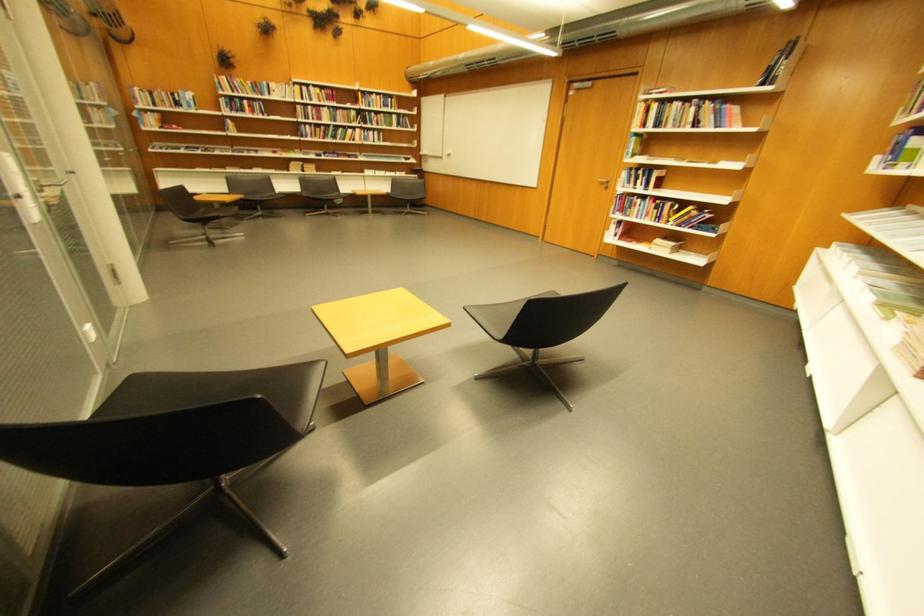
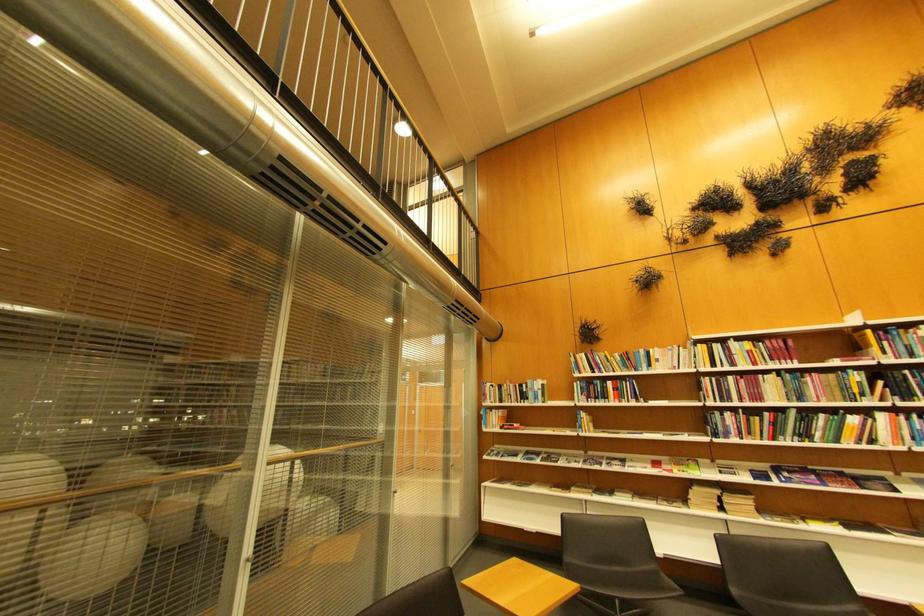
Find the pixel in the second image that matches (343,128) in the first image.

(804, 413)